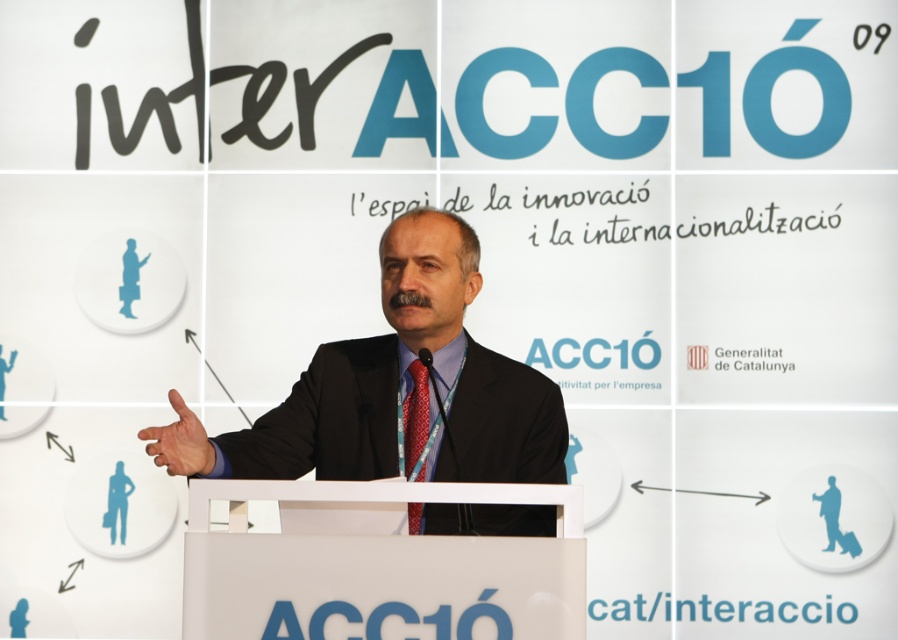
Question: Can you confirm if black suit at center is positioned to the right of red silk tie at center?

Choices:
 (A) yes
 (B) no

Answer: (B)

Question: Which of the following is the closest to the observer?

Choices:
 (A) black suit at center
 (B) red silk tie at center

Answer: (A)

Question: Considering the relative positions of black suit at center and red silk tie at center in the image provided, where is black suit at center located with respect to red silk tie at center?

Choices:
 (A) left
 (B) right

Answer: (A)

Question: Which point is closer to the camera?

Choices:
 (A) (419, 454)
 (B) (285, 477)

Answer: (B)

Question: Does black suit at center appear under red silk tie at center?

Choices:
 (A) no
 (B) yes

Answer: (A)